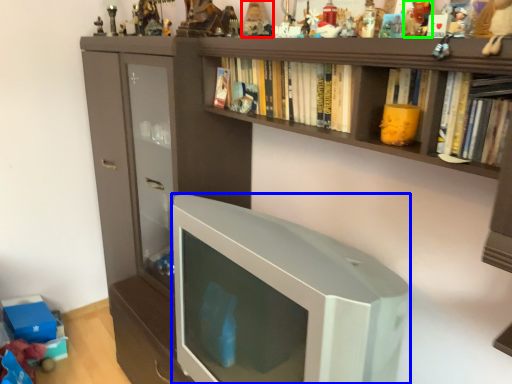
Question: Which is nearer to the toy (highlighted by a red box)? television (highlighted by a blue box) or toy (highlighted by a green box).

Choices:
 (A) television
 (B) toy

Answer: (B)